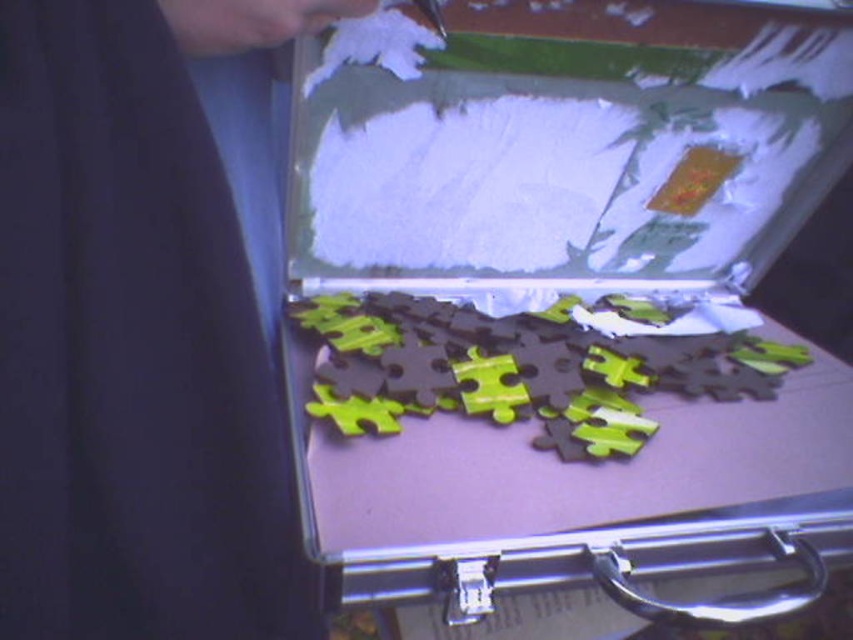
You are trying to organize the items in the briefcase. Which item, the matte plastic puzzle pieces at center or the dark fabric at upper left, has a larger surface area?

The matte plastic puzzle pieces at center has a larger surface area than the dark fabric at upper left.

You are trying to organize the items in the briefcase. The dark fabric at upper left and the matte green puzzle pieces at center are both in the way. Which item should you move first to access the other?

The dark fabric at upper left is closer to the viewer than the matte green puzzle pieces at center, so you should move the dark fabric at upper left first to access the matte green puzzle pieces at center.